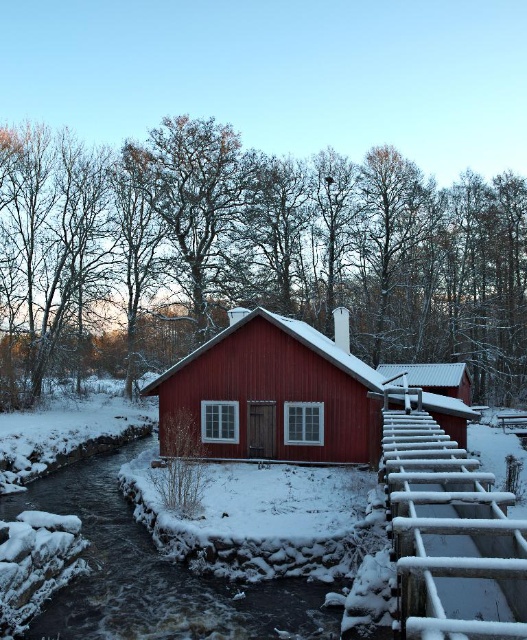
You are standing at the point located at coordinates (268, 396) in the image. Looking around, you see a small red wooden house with a snow roof and a stone dam with a waterfall. Which object are you currently standing on?

You are standing on the matte wood cabin at center, as the point coordinates (268, 396) are located on it according to the description.

You are a visitor approaching the matte wood cabin at center via the wooden walkway. As you walk towards the cabin, does the white wooden rail at lower right become visible before the cabin?

The matte wood cabin at center is positioned over the white wooden rail at lower right, so the cabin would block the view of the rail until you get closer. The white wooden rail at lower right becomes visible only after you pass the cabin.

You are a visitor approaching the matte wood cabin at center and want to reach the white wooden rail at lower right. Based on the scene, which direction should you move relative to the cabin to get there?

Result: To reach the white wooden rail at lower right from the matte wood cabin at center, you should move towards the lower right direction since the white wooden rail at lower right is located behind the cabin and positioned to the lower right side of the cabin.